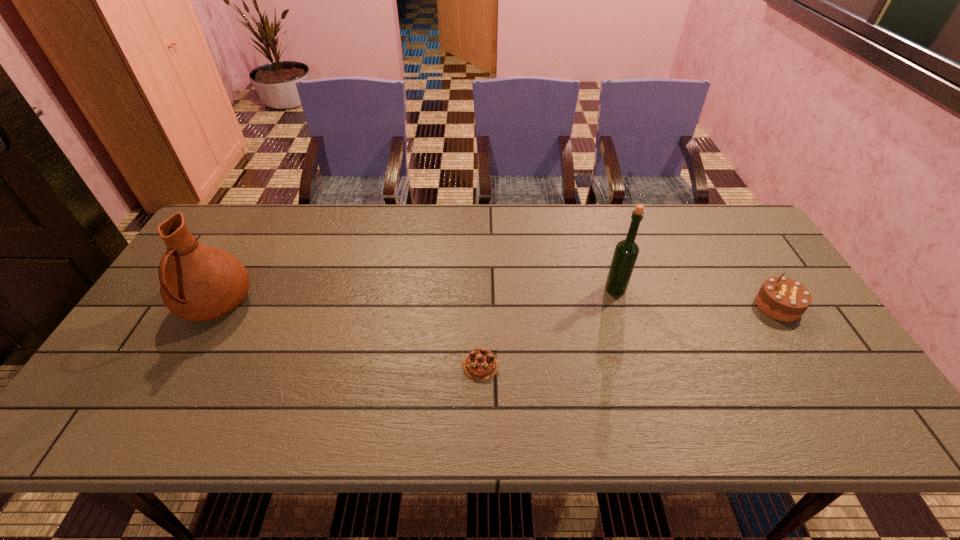
You are a GUI agent. You are given a task and a screenshot of the screen. Output one action in this format:
    pyautogui.click(x=<x>, y=<y>)
    Task: Click on the liquor
    Image resolution: width=960 pixels, height=540 pixels.
    Given the screenshot: What is the action you would take?
    (626, 252)

The height and width of the screenshot is (540, 960). In order to click on pitcher in this screenshot , I will do `click(199, 283)`.

At what (x,y) coordinates should I click in order to perform the action: click on the taller chocolate cake. Please return your answer as a coordinate pair (x, y). The height and width of the screenshot is (540, 960). Looking at the image, I should click on (783, 299).

Where is `the rightmost object`? This screenshot has height=540, width=960. the rightmost object is located at coordinates (783, 299).

This screenshot has width=960, height=540. I want to click on the shortest object, so click(480, 365).

Where is `the shorter chocolate cake`? The height and width of the screenshot is (540, 960). the shorter chocolate cake is located at coordinates (480, 365).

Where is `vacant region located on the back of the second object from right to left`? vacant region located on the back of the second object from right to left is located at coordinates (591, 209).

Locate an element on the screen. vacant point located on the side of the leftmost object with the handle is located at coordinates (154, 416).

This screenshot has height=540, width=960. I want to click on vacant space located 0.050m on the back of the third tallest object, so click(760, 278).

I want to click on free space located 0.080m on the right of the left chocolate cake, so click(x=532, y=366).